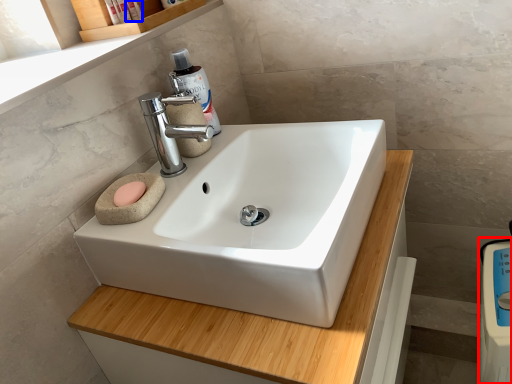
Question: Among these objects, which one is farthest to the camera, appliance (highlighted by a red box) or toiletry (highlighted by a blue box)?

Choices:
 (A) appliance
 (B) toiletry

Answer: (B)